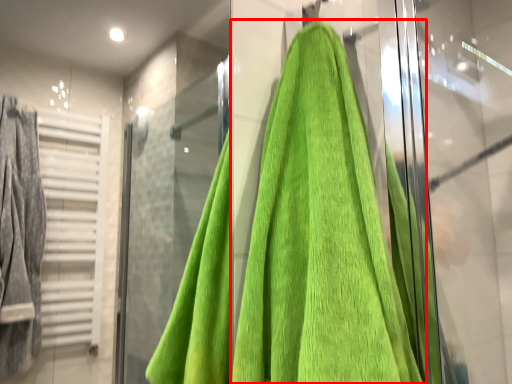
Question: In this image, where is towel (annotated by the red box) located relative to screen door?

Choices:
 (A) right
 (B) left

Answer: (B)